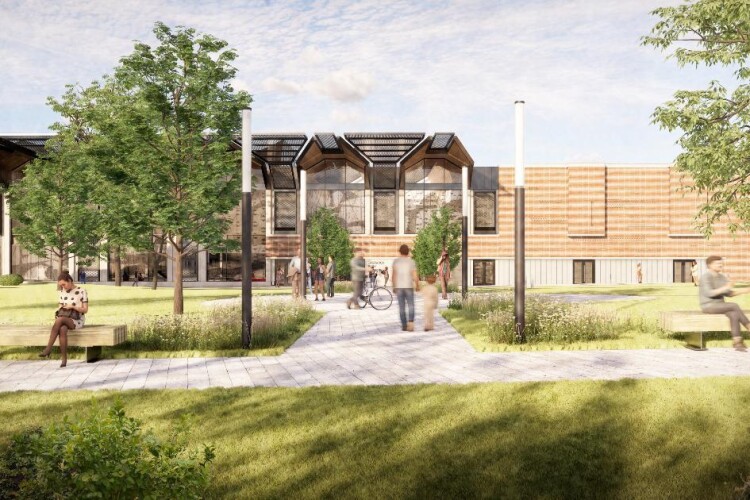
Find the location of a particular element. The width and height of the screenshot is (750, 500). windows is located at coordinates (352, 178), (430, 175).